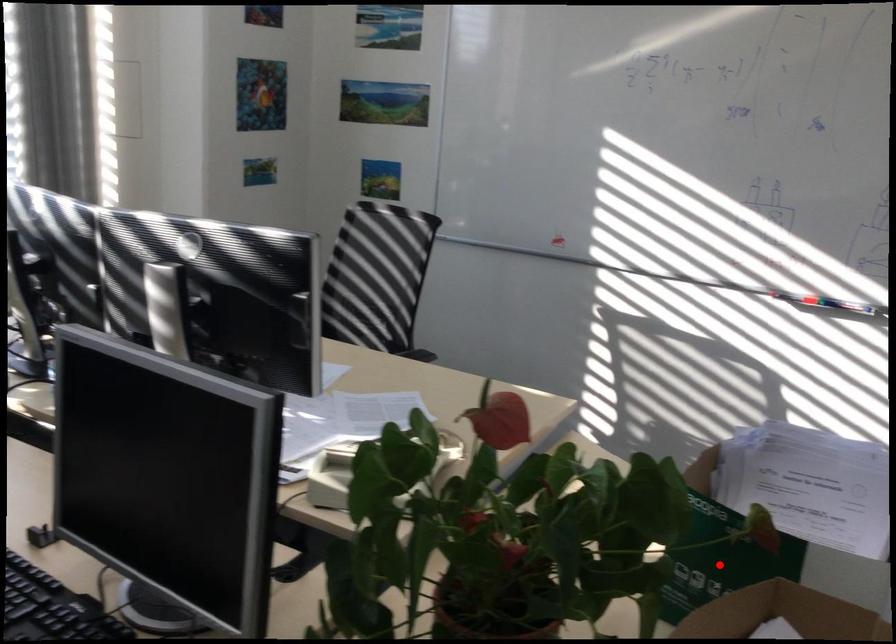
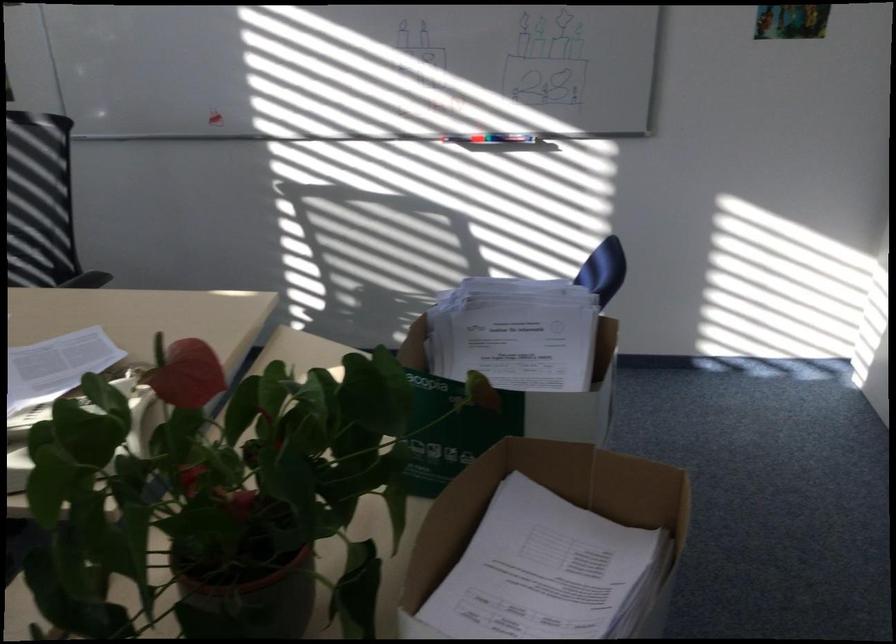
Locate, in the second image, the point that corresponds to the highlighted location in the first image.

(451, 431)